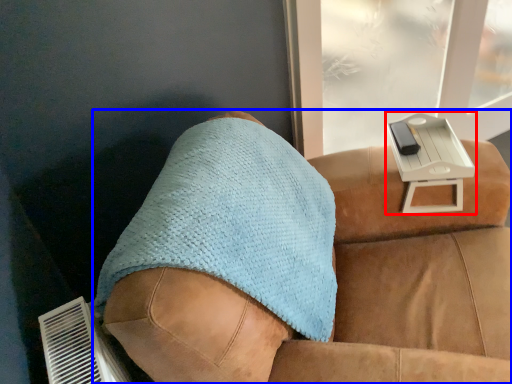
Question: Which of the following is the closest to the observer, table (highlighted by a red box) or furniture (highlighted by a blue box)?

Choices:
 (A) table
 (B) furniture

Answer: (B)